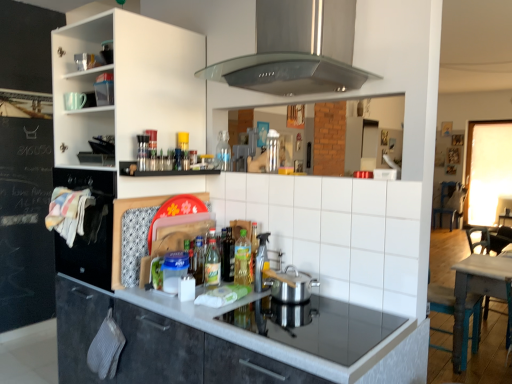
The height and width of the screenshot is (384, 512). Find the location of `vacant space in front of translucent plastic bottle at center, acting as the first bottle starting from the bottom`. vacant space in front of translucent plastic bottle at center, acting as the first bottle starting from the bottom is located at coordinates (204, 299).